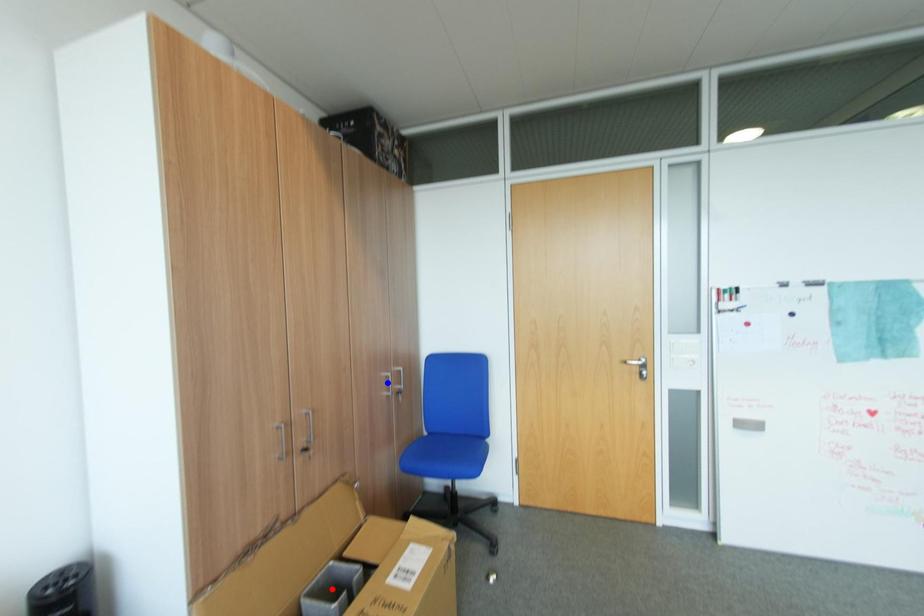
Question: Two points are marked on the image. Which point is closer to the camera?

Choices:
 (A) Blue point is closer.
 (B) Red point is closer.

Answer: (B)